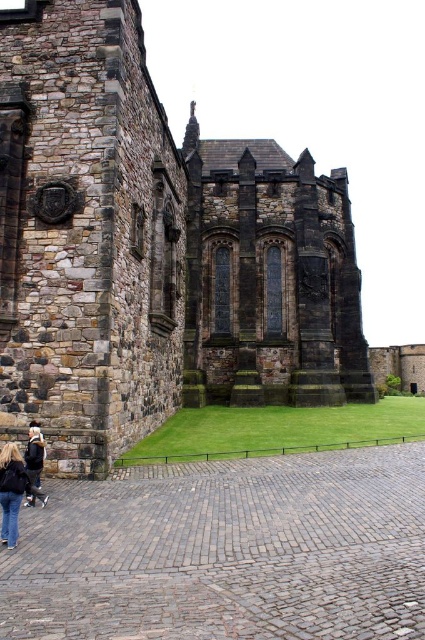
Question: Among these objects, which one is farthest from the camera?

Choices:
 (A) rustic stone castle at center
 (B) denim jacket at lower left

Answer: (A)

Question: Is denim jacket at lower left thinner than dark brown leather jacket at lower left?

Choices:
 (A) yes
 (B) no

Answer: (A)

Question: Estimate the real-world distances between objects in this image. Which object is farther from the rustic stone castle at center?

Choices:
 (A) denim jacket at lower left
 (B) dark brown leather jacket at lower left

Answer: (A)

Question: Which point is closer to the camera taking this photo?

Choices:
 (A) (36, 436)
 (B) (8, 476)

Answer: (B)

Question: Can you confirm if rustic stone castle at center is positioned below dark brown leather jacket at lower left?

Choices:
 (A) no
 (B) yes

Answer: (A)

Question: Does rustic stone castle at center have a larger size compared to denim jacket at lower left?

Choices:
 (A) no
 (B) yes

Answer: (B)